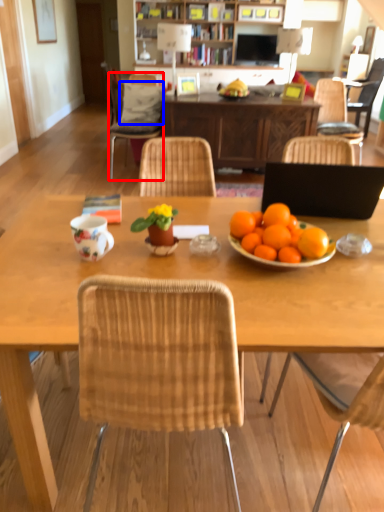
Question: Which point is further to the camera, chair (highlighted by a red box) or pillow (highlighted by a blue box)?

Choices:
 (A) chair
 (B) pillow

Answer: (B)